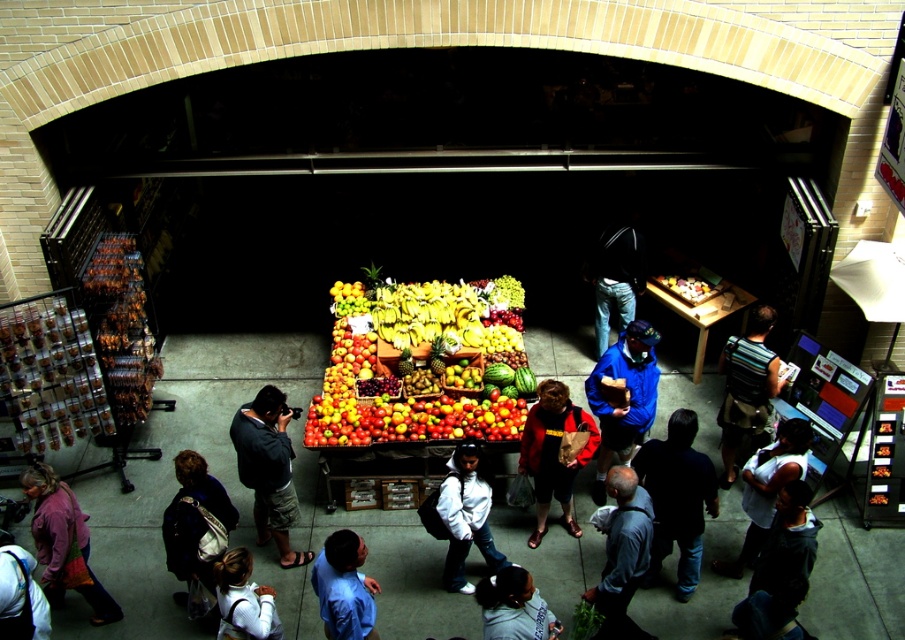
Question: Based on their relative distances, which object is nearer to the dark blue jacket at lower left?

Choices:
 (A) striped t-shirt at center
 (B) white matte jacket at center
 (C) dark blue jeans at center
 (D) dark blue shirt at center

Answer: (B)

Question: Estimate the real-world distances between objects in this image. Which object is farther from the white hoodie at lower center?

Choices:
 (A) dark blue jeans at lower right
 (B) blue jacket at center
 (C) white cotton tank top at lower right

Answer: (C)

Question: Which object appears farthest from the camera in this image?

Choices:
 (A) dark blue jacket at lower left
 (B) white hoodie at lower center

Answer: (A)

Question: Is blue jacket at center to the right of dark blue jacket at lower left from the viewer's perspective?

Choices:
 (A) yes
 (B) no

Answer: (A)

Question: Observing the image, what is the correct spatial positioning of dark blue shirt at center in reference to dark blue jeans at center?

Choices:
 (A) left
 (B) right

Answer: (B)

Question: Where is dark blue sweater at center located in relation to white hoodie at lower center in the image?

Choices:
 (A) above
 (B) below

Answer: (A)